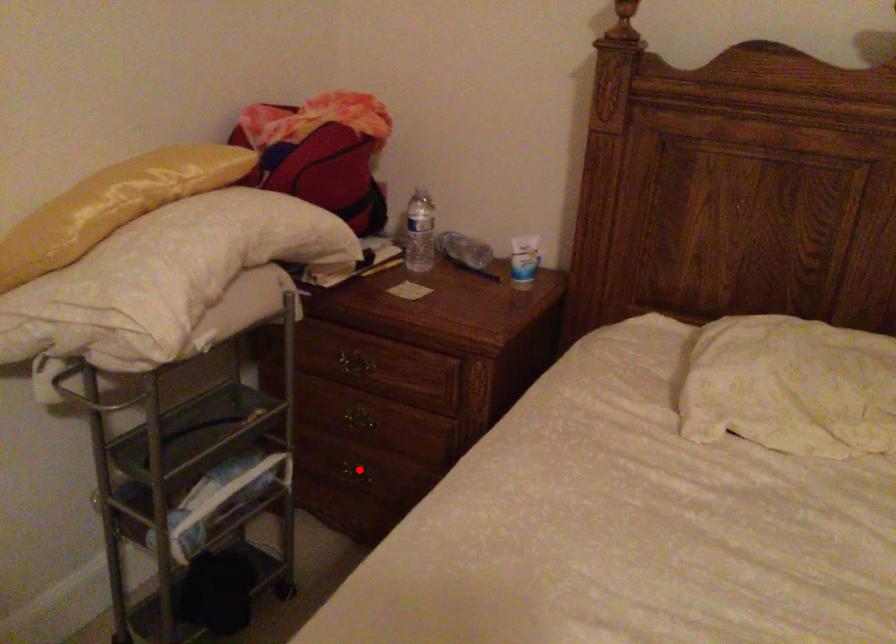
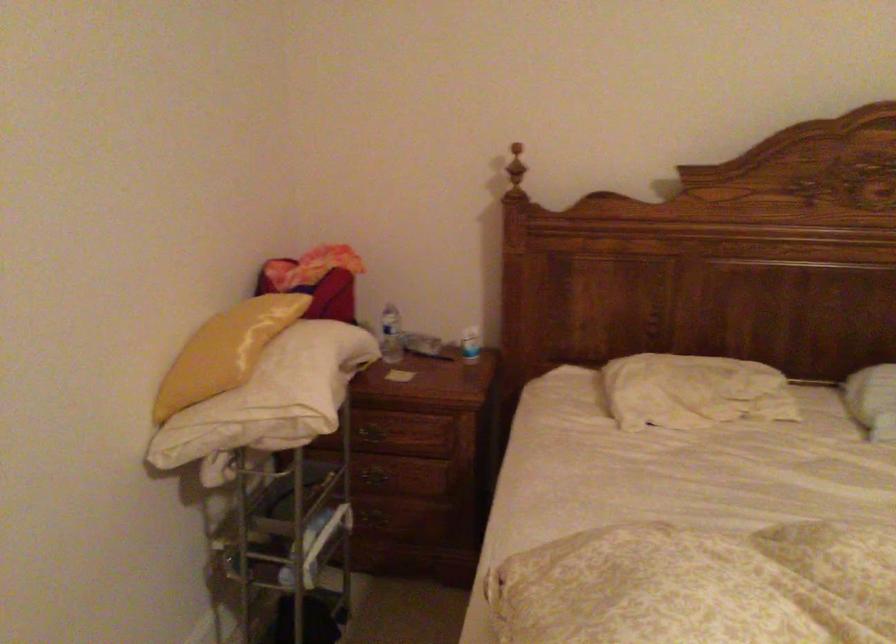
In the second image, find the point that corresponds to the highlighted location in the first image.

(381, 516)